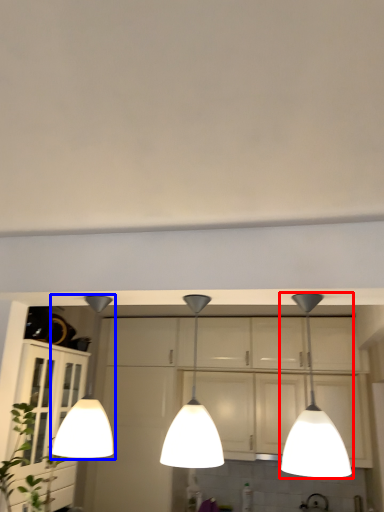
Question: Among these objects, which one is nearest to the camera, lamp (highlighted by a red box) or lamp (highlighted by a blue box)?

Choices:
 (A) lamp
 (B) lamp

Answer: (A)